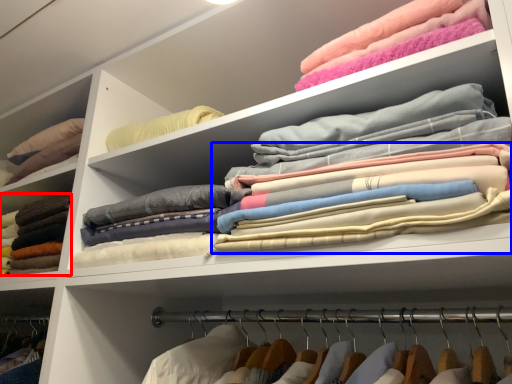
Question: Which object is closer to the camera taking this photo, clothing (highlighted by a red box) or clothing (highlighted by a blue box)?

Choices:
 (A) clothing
 (B) clothing

Answer: (B)